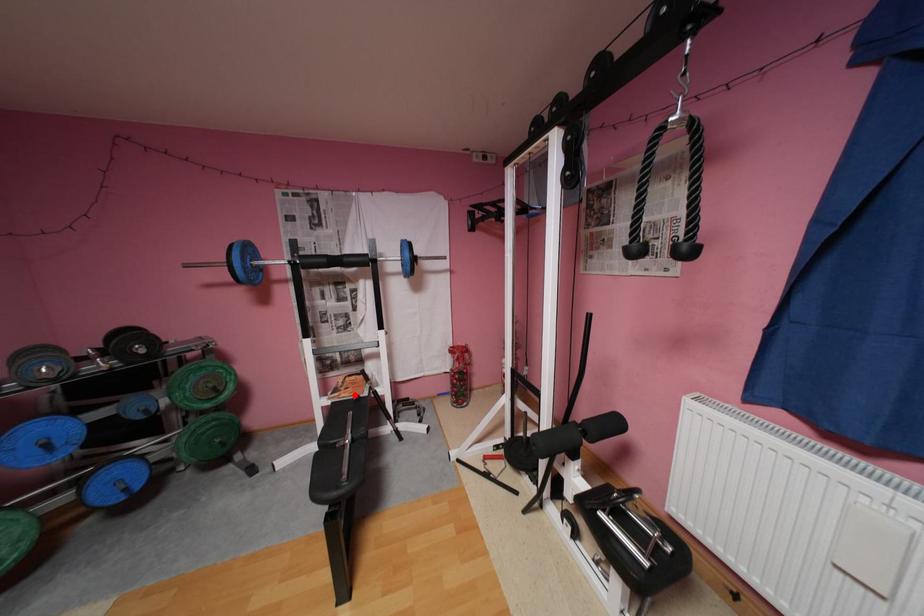
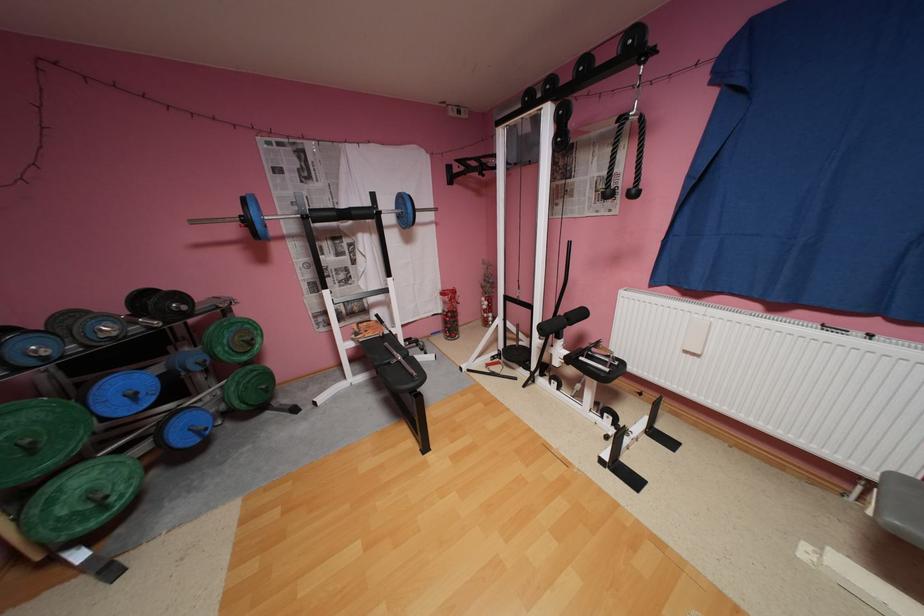
Question: I am providing you with two images of the same scene from different viewpoints. In image1, a red point is highlighted. Considering the same 3D point in image2, which of the following is correct?

Choices:
 (A) It is closer
 (B) It is farther

Answer: (B)